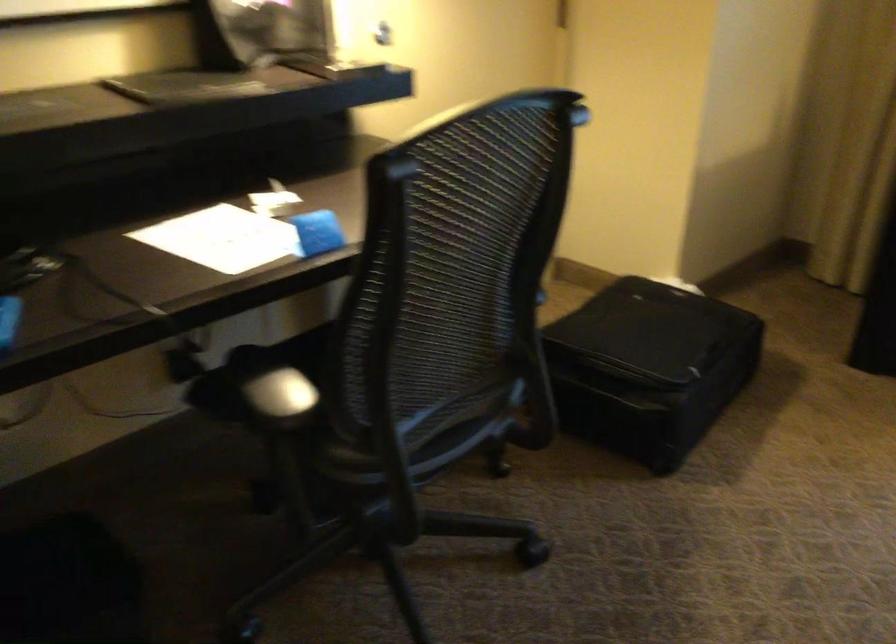
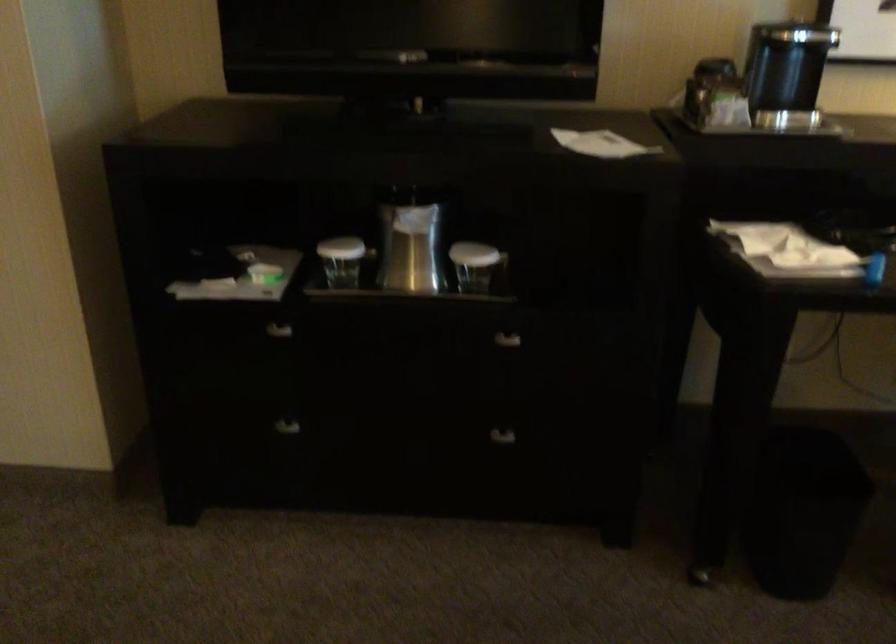
Question: The camera is either moving clockwise (left) or counter-clockwise (right) around the object. The first image is from the beginning of the video and the second image is from the end. Is the camera moving left or right when shooting the video?

Choices:
 (A) Left
 (B) Right

Answer: (B)